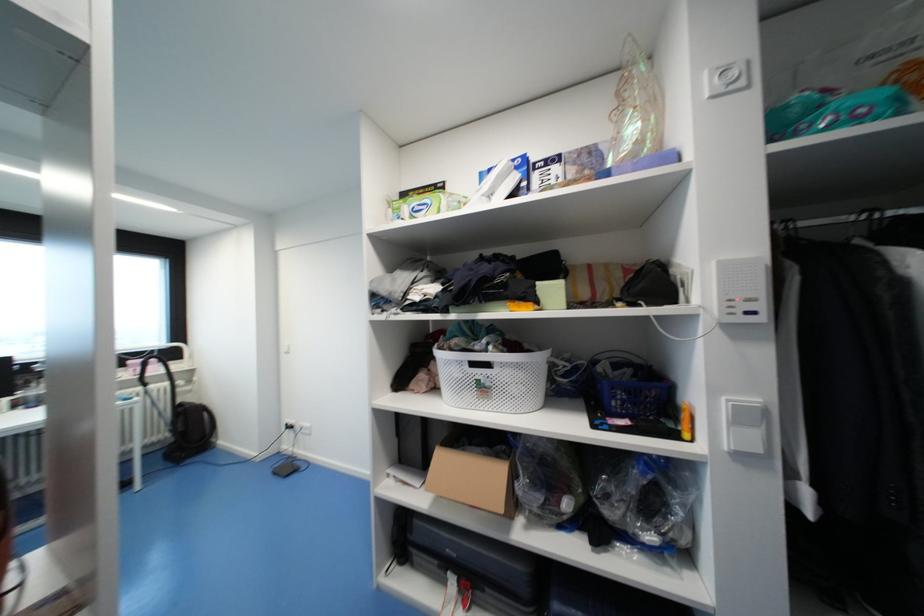
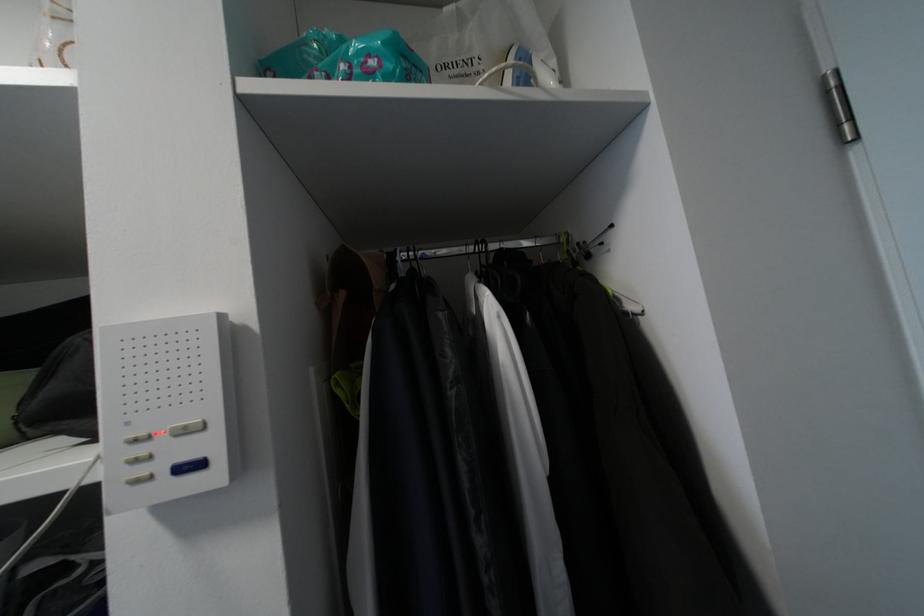
Question: The camera is either moving clockwise (left) or counter-clockwise (right) around the object. The first image is from the beginning of the video and the second image is from the end. Is the camera moving left or right when shooting the video?

Choices:
 (A) Left
 (B) Right

Answer: (A)